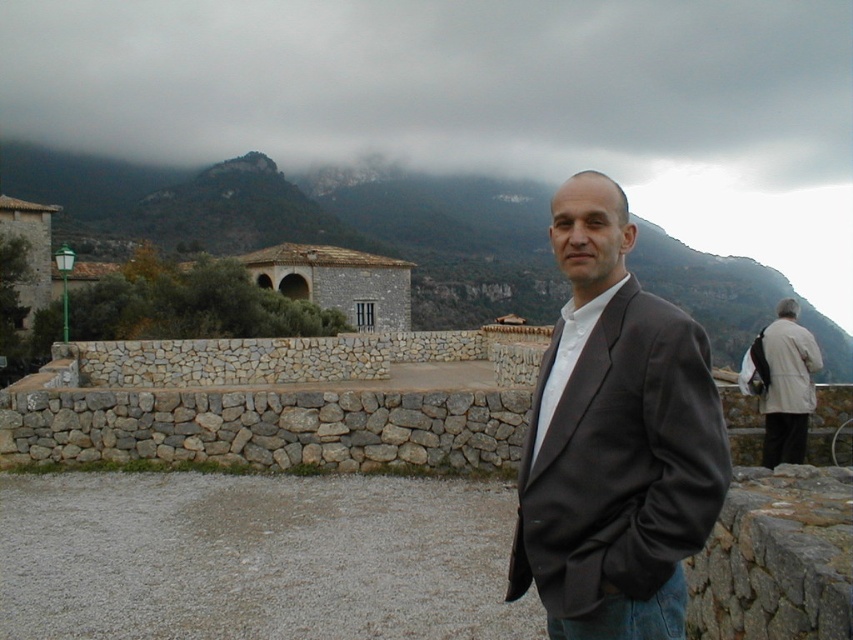
Does rocky mountain at upper center appear under light beige coat at right?

Actually, rocky mountain at upper center is above light beige coat at right.

Does point (9, 148) come behind point (776, 346)?

That is True.

Identify the location of rocky mountain at upper center. The image size is (853, 640). (311, 221).

Does matte black suit at center come in front of rocky mountain at upper center?

Yes, it is.

Can you confirm if matte black suit at center is taller than rocky mountain at upper center?

Incorrect, matte black suit at center's height is not larger of rocky mountain at upper center's.

Is point (650, 509) in front of point (234, 228)?

That is True.

Find the location of a particular element. The height and width of the screenshot is (640, 853). matte black suit at center is located at coordinates (614, 440).

Who is positioned more to the right, matte black suit at center or light beige coat at right?

From the viewer's perspective, light beige coat at right appears more on the right side.

Between point (608, 490) and point (769, 352), which one is positioned behind?

The point (769, 352) is more distant.

Where is `matte black suit at center`? The image size is (853, 640). matte black suit at center is located at coordinates (614, 440).